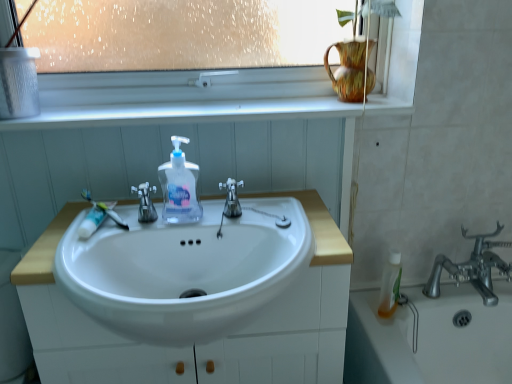
Question: Can you confirm if translucent plastic mouthwash at lower right is bigger than satin nickel faucet at center, acting as the first tap starting from the left?

Choices:
 (A) no
 (B) yes

Answer: (B)

Question: Are translucent plastic mouthwash at lower right and satin nickel faucet at center, acting as the first tap starting from the left, making contact?

Choices:
 (A) yes
 (B) no

Answer: (B)

Question: From the image's perspective, is translucent plastic mouthwash at lower right below satin nickel faucet at center, acting as the first tap starting from the left?

Choices:
 (A) yes
 (B) no

Answer: (A)

Question: Considering the relative sizes of translucent plastic mouthwash at lower right and satin nickel faucet at center, arranged as the second tap when viewed from the right, in the image provided, is translucent plastic mouthwash at lower right wider than satin nickel faucet at center, arranged as the second tap when viewed from the right,?

Choices:
 (A) no
 (B) yes

Answer: (A)

Question: Is translucent plastic mouthwash at lower right not inside satin nickel faucet at center, acting as the first tap starting from the left?

Choices:
 (A) yes
 (B) no

Answer: (A)

Question: Is white glossy cabinet at center bigger or smaller than white plastic window frame at upper center?

Choices:
 (A) small
 (B) big

Answer: (B)

Question: From the image's perspective, is white glossy cabinet at center above or below white plastic window frame at upper center?

Choices:
 (A) above
 (B) below

Answer: (B)

Question: Is white glossy cabinet at center taller or shorter than white plastic window frame at upper center?

Choices:
 (A) short
 (B) tall

Answer: (B)

Question: Is white glossy cabinet at center in front of or behind white plastic window frame at upper center in the image?

Choices:
 (A) front
 (B) behind

Answer: (A)

Question: From the image's perspective, is white plastic toothbrush at left above or below white glossy window sill at upper center?

Choices:
 (A) above
 (B) below

Answer: (B)

Question: From their relative heights in the image, would you say white plastic toothbrush at left is taller or shorter than white glossy window sill at upper center?

Choices:
 (A) tall
 (B) short

Answer: (A)

Question: From a real-world perspective, is white plastic toothbrush at left positioned above or below white glossy window sill at upper center?

Choices:
 (A) above
 (B) below

Answer: (B)

Question: Looking at the image, does white plastic toothbrush at left seem bigger or smaller compared to white glossy window sill at upper center?

Choices:
 (A) big
 (B) small

Answer: (B)

Question: Is point (386, 288) closer or farther from the camera than point (226, 188)?

Choices:
 (A) farther
 (B) closer

Answer: (A)

Question: From a real-world perspective, is translucent plastic mouthwash at lower right above or below polished chrome faucet at center, the second tap positioned from the left?

Choices:
 (A) above
 (B) below

Answer: (B)